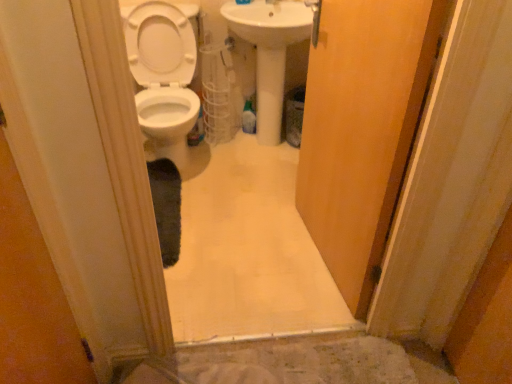
Find the location of a particular element. The image size is (512, 384). vacant region to the left of wooden door at center is located at coordinates (242, 253).